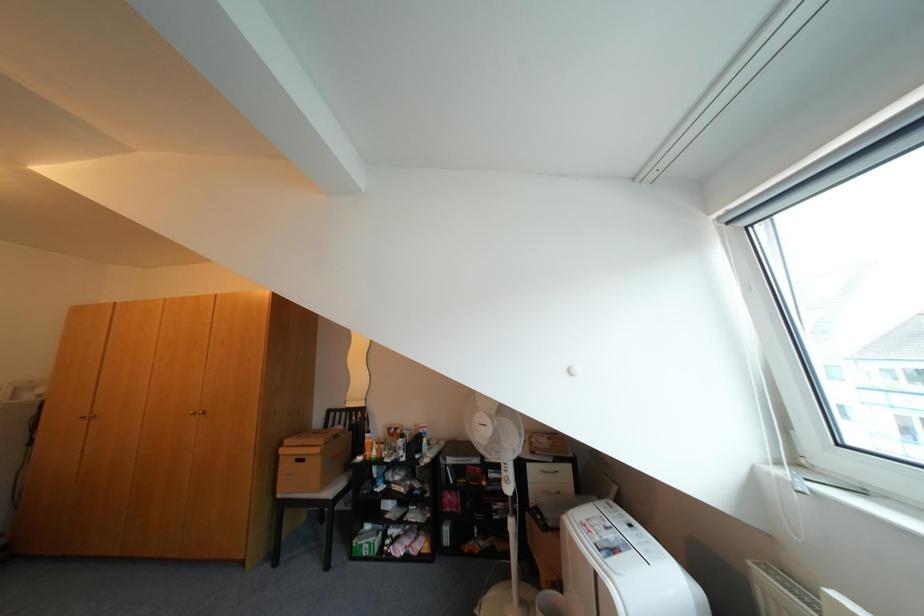
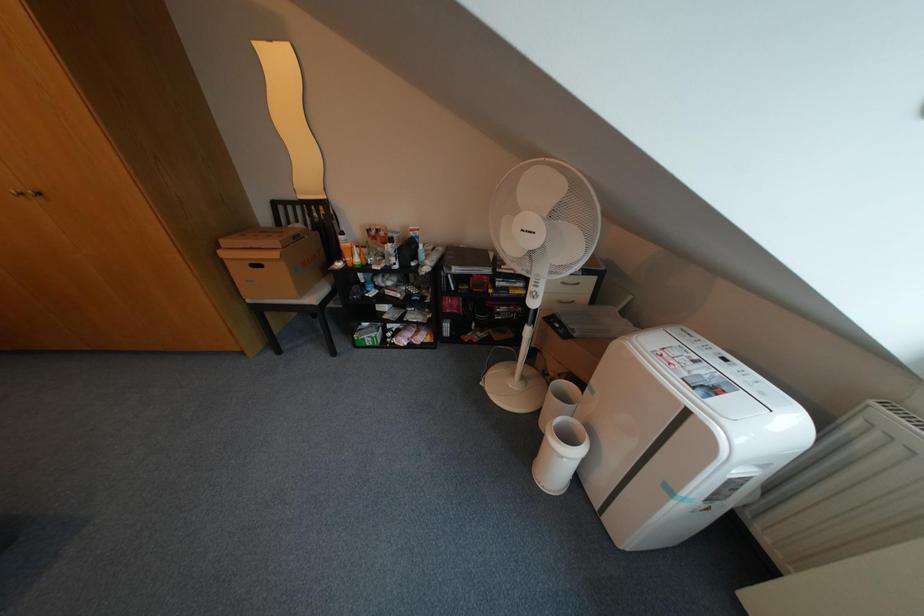
Question: Based on the continuous images, in which direction is the camera rotating? Reply with the corresponding letter.

Choices:
 (A) Left
 (B) Right
 (C) Up
 (D) Down

Answer: (D)